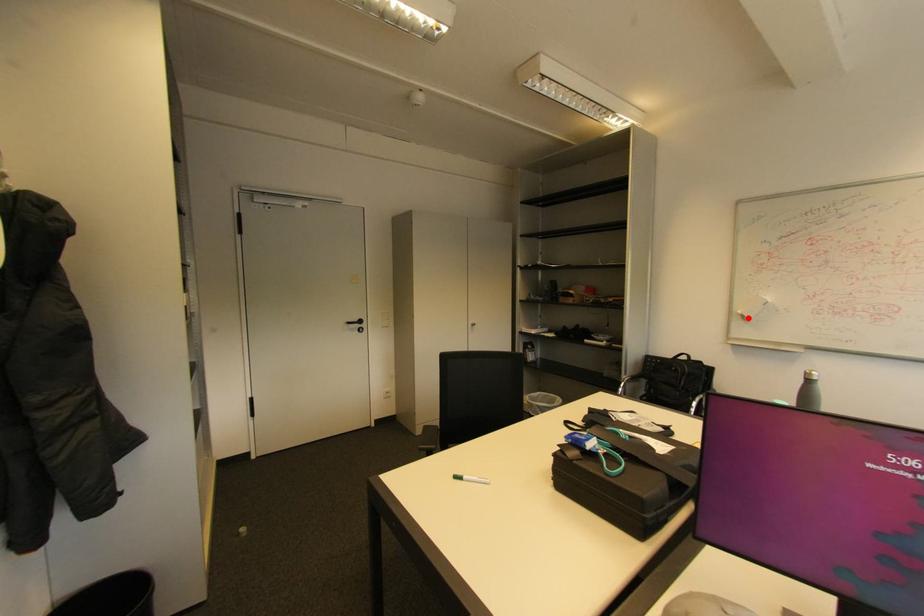
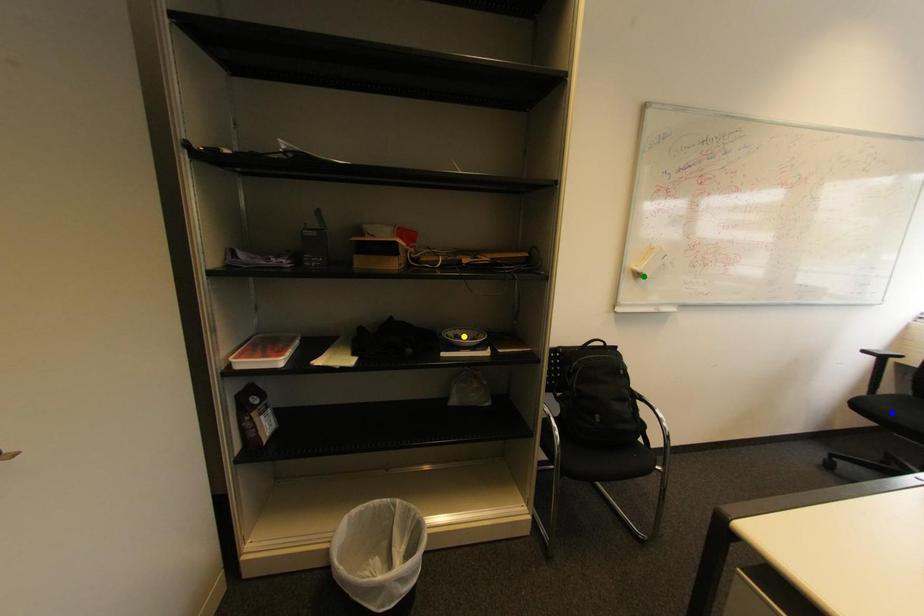
Question: I am providing you with two images of the same scene from different viewpoints. A red point is marked on the first image. You are given multiple points on the second image. Which spot in image 2 lines up with the point in image 1?

Choices:
 (A) yellow point
 (B) blue point
 (C) green point

Answer: (C)